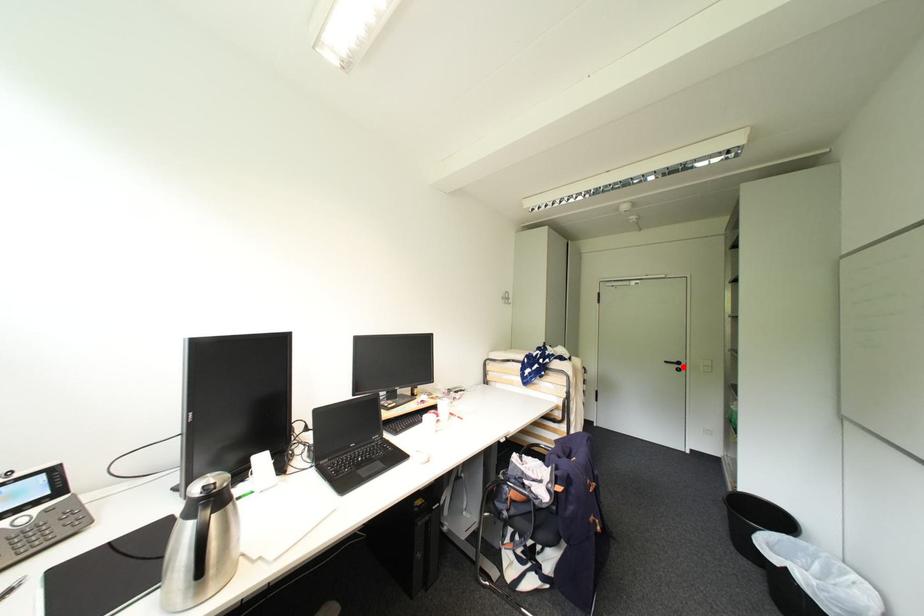
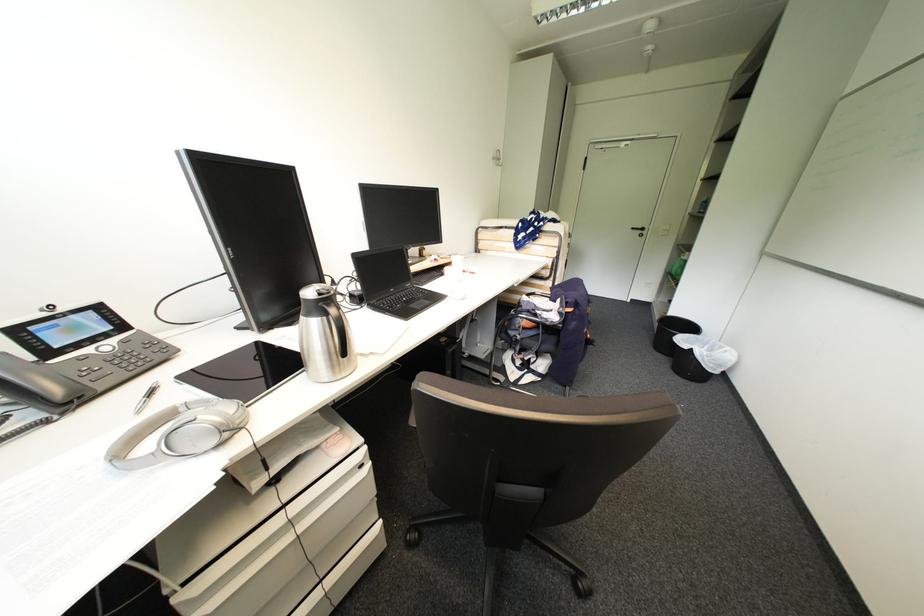
In the second image, find the point that corresponds to the highlighted location in the first image.

(648, 233)